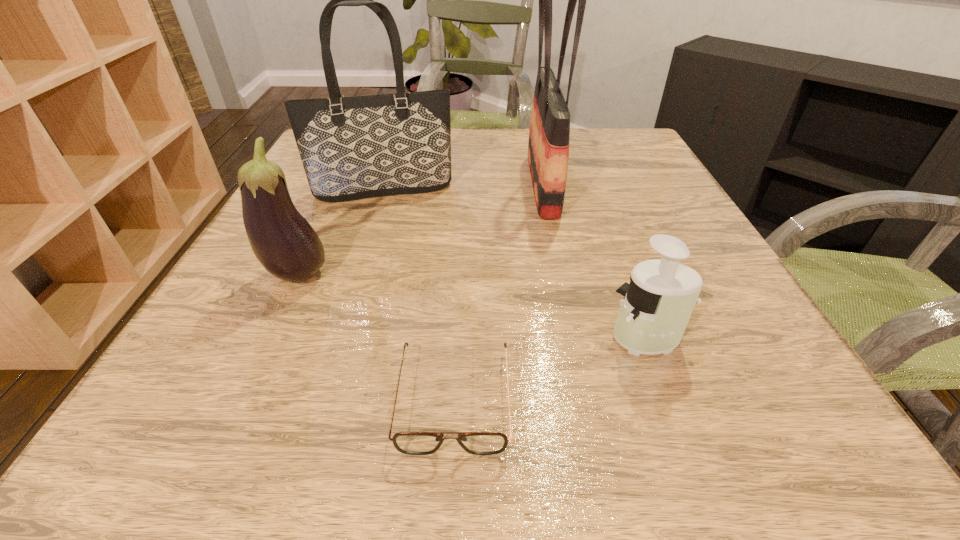
At what (x,y) coordinates should I click in order to perform the action: click on shopping bag. Please return your answer as a coordinate pair (x, y). This screenshot has height=540, width=960. Looking at the image, I should click on (548, 149).

Locate an element on the screen. The width and height of the screenshot is (960, 540). tote bag is located at coordinates (357, 147).

Find the location of a particular element. The width and height of the screenshot is (960, 540). the third tallest object is located at coordinates point(283,241).

Where is `eggplant`? The width and height of the screenshot is (960, 540). eggplant is located at coordinates (283, 241).

The width and height of the screenshot is (960, 540). What are the coordinates of `the second shortest object` in the screenshot? It's located at (657, 305).

You are a GUI agent. You are given a task and a screenshot of the screen. Output one action in this format:
    pyautogui.click(x=<x>, y=<y>)
    Task: Click on the rightmost object
    This screenshot has width=960, height=540.
    Given the screenshot: What is the action you would take?
    coord(657,305)

Identify the location of sunglasses. This screenshot has width=960, height=540. (413, 443).

At what (x,y) coordinates should I click in order to perform the action: click on free space located on the front-facing side of the shopping bag. Please return your answer as a coordinate pair (x, y). Looking at the image, I should click on (471, 185).

The image size is (960, 540). I want to click on vacant space situated on the front-facing side of the shopping bag, so click(x=391, y=185).

Locate an element on the screen. free spot located on the front-facing side of the shopping bag is located at coordinates (490, 185).